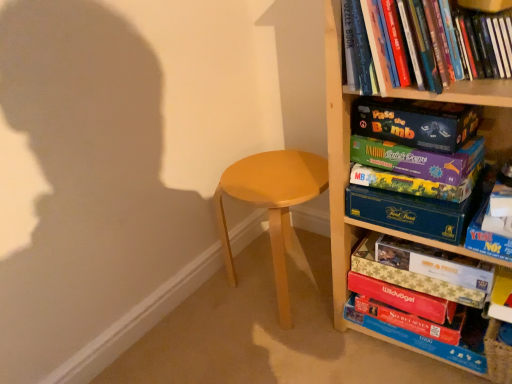
In order to click on red cardboard puzzle at lower right, the first book in the bottom-to-top sequence in this screenshot , I will do [x=406, y=275].

Describe the element at coordinates (414, 320) in the screenshot. I see `red matte board game at lower right, acting as the first paperback book starting from the bottom` at that location.

What is the approximate width of light brown wood stool at center?

16.98 inches.

In order to click on gold foil puzzle box at lower right, the fifth paperback book in the top-to-bottom sequence in this screenshot , I will do `click(435, 263)`.

Describe the element at coordinates (415, 122) in the screenshot. I see `matte black game box at upper right, which is counted as the seventh paperback book, starting from the bottom` at that location.

You are a GUI agent. You are given a task and a screenshot of the screen. Output one action in this format:
    pyautogui.click(x=<x>, y=<y>)
    Task: Click on the wooden bookcase at right
    
    Given the screenshot: What is the action you would take?
    pyautogui.click(x=347, y=182)

Locate an element on the screen. This screenshot has width=512, height=384. hardcover book at upper right, the second book in the top-to-bottom sequence is located at coordinates (485, 44).

How much space does hardcover book at upper right, which appears as the second book when ordered from the bottom, occupy horizontally?

It is 7.22 inches.

Locate an element on the screen. The width and height of the screenshot is (512, 384). red cardboard puzzle at lower right, the first book in the bottom-to-top sequence is located at coordinates (406, 275).

Is gold foil puzzle box at lower right, the fifth paperback book in the top-to-bottom sequence, far away from blue cardboard game box at center-right, placed as the 4th paperback book when sorted from top to bottom?

Actually, gold foil puzzle box at lower right, the fifth paperback book in the top-to-bottom sequence, and blue cardboard game box at center-right, placed as the 4th paperback book when sorted from top to bottom, are a little close together.

Is gold foil puzzle box at lower right, which ranks as the third paperback book in bottom-to-top order, aimed at blue cardboard game box at center-right, placed as the 4th paperback book when sorted from top to bottom?

No, gold foil puzzle box at lower right, which ranks as the third paperback book in bottom-to-top order, is not oriented towards blue cardboard game box at center-right, placed as the 4th paperback book when sorted from top to bottom.

Does point (450, 275) appear closer or farther from the camera than point (368, 192)?

Point (450, 275).

From the image's perspective, which is above, gold foil puzzle box at lower right, the fifth paperback book in the top-to-bottom sequence, or blue cardboard game box at center-right, the fourth paperback book positioned from the bottom?

blue cardboard game box at center-right, the fourth paperback book positioned from the bottom, appears higher in the image.

Would you consider red matte board game at lower right, which appears as the second paperback book when ordered from the bottom, to be distant from matte purple board game at center-right, which appears as the third paperback book when viewed from the top?

red matte board game at lower right, which appears as the second paperback book when ordered from the bottom, is actually quite close to matte purple board game at center-right, which appears as the third paperback book when viewed from the top.

Is red matte board game at lower right, the 6th paperback book from the top, positioned beyond the bounds of matte purple board game at center-right, which appears as the third paperback book when viewed from the top?

Yes.

Between red matte board game at lower right, which appears as the second paperback book when ordered from the bottom, and matte purple board game at center-right, which appears as the fifth paperback book when ordered from the bottom, which one has larger width?

red matte board game at lower right, which appears as the second paperback book when ordered from the bottom.

Between red matte board game at lower right, which appears as the second paperback book when ordered from the bottom, and matte purple board game at center-right, which appears as the fifth paperback book when ordered from the bottom, which one has less height?

Standing shorter between the two is matte purple board game at center-right, which appears as the fifth paperback book when ordered from the bottom.

Which of these two, light brown wood stool at center or gold foil puzzle box at lower right, the fifth paperback book in the top-to-bottom sequence, stands shorter?

Standing shorter between the two is gold foil puzzle box at lower right, the fifth paperback book in the top-to-bottom sequence.

Which paperback book is the 7th one when counting from the right side of the light brown wood stool at center? Please provide its 2D coordinates.

[(435, 263)]

Which of these two, light brown wood stool at center or gold foil puzzle box at lower right, which ranks as the third paperback book in bottom-to-top order, is bigger?

light brown wood stool at center is bigger.

Between light brown wood stool at center and gold foil puzzle box at lower right, which ranks as the third paperback book in bottom-to-top order, which one appears on the left side from the viewer's perspective?

light brown wood stool at center is more to the left.

Consider the image. Does red matte board game at lower right, which appears as the second paperback book when ordered from the bottom, appear on the right side of hardcover books at upper right, the third book positioned from the bottom?

Yes, red matte board game at lower right, which appears as the second paperback book when ordered from the bottom, is to the right of hardcover books at upper right, the third book positioned from the bottom.

Identify the location of the 6th paperback book located beneath the hardcover books at upper right, the third book positioned from the bottom (from a real-world perspective). (403, 298).

Does point (430, 318) come behind point (429, 88)?

Yes, it is.

Can you confirm if light brown wood stool at center is positioned to the left of red matte board game at lower right, the 6th paperback book from the top?

Yes, light brown wood stool at center is to the left of red matte board game at lower right, the 6th paperback book from the top.

Can we say light brown wood stool at center lies outside red matte board game at lower right, which appears as the second paperback book when ordered from the bottom?

Yes, light brown wood stool at center is outside of red matte board game at lower right, which appears as the second paperback book when ordered from the bottom.

From the image's perspective, would you say light brown wood stool at center is positioned over red matte board game at lower right, the 6th paperback book from the top?

Yes, from the image's perspective, light brown wood stool at center is on top of red matte board game at lower right, the 6th paperback book from the top.

Is light brown wood stool at center facing away from red matte board game at lower right, the 6th paperback book from the top?

No.

From the image's perspective, who appears lower, matte black game box at upper right, arranged as the 1th paperback book when viewed from the top, or red cardboard puzzle at lower right, the third book positioned from the top?

red cardboard puzzle at lower right, the third book positioned from the top, is shown below in the image.

Is the position of matte black game box at upper right, arranged as the 1th paperback book when viewed from the top, less distant than that of red cardboard puzzle at lower right, the third book positioned from the top?

Yes, matte black game box at upper right, arranged as the 1th paperback book when viewed from the top, is closer to the camera.

Is matte black game box at upper right, arranged as the 1th paperback book when viewed from the top, positioned beyond the bounds of red cardboard puzzle at lower right, the third book positioned from the top?

Yes, matte black game box at upper right, arranged as the 1th paperback book when viewed from the top, is located beyond the bounds of red cardboard puzzle at lower right, the third book positioned from the top.

Which is more to the right, gold foil puzzle box at lower right, which ranks as the third paperback book in bottom-to-top order, or hardcover books at upper right, the third book positioned from the bottom?

gold foil puzzle box at lower right, which ranks as the third paperback book in bottom-to-top order.

From a real-world perspective, is gold foil puzzle box at lower right, which ranks as the third paperback book in bottom-to-top order, physically below hardcover books at upper right, which appears as the first book when viewed from the top?

Correct, in the physical world, gold foil puzzle box at lower right, which ranks as the third paperback book in bottom-to-top order, is lower than hardcover books at upper right, which appears as the first book when viewed from the top.

Are gold foil puzzle box at lower right, the fifth paperback book in the top-to-bottom sequence, and hardcover books at upper right, the third book positioned from the bottom, beside each other?

They are not placed beside each other.

Is gold foil puzzle box at lower right, the fifth paperback book in the top-to-bottom sequence, facing away from hardcover books at upper right, which appears as the first book when viewed from the top?

No, hardcover books at upper right, which appears as the first book when viewed from the top, is not at the back of gold foil puzzle box at lower right, the fifth paperback book in the top-to-bottom sequence.

There is a blue cardboard game box at center-right, placed as the 4th paperback book when sorted from top to bottom. Where is `the 1st paperback book below it (from the image's perspective)`? The image size is (512, 384). the 1st paperback book below it (from the image's perspective) is located at coordinates (435, 263).

From the matte purple board game at center-right, which appears as the fifth paperback book when ordered from the bottom, count 3rd paperback books backward and point to it. Please provide its 2D coordinates.

[(403, 298)]

Estimate the real-world distances between objects in this image. Which object is further from hardcover books at upper right, which appears as the first book when viewed from the top, red cardboard puzzle at lower right, the third book positioned from the top, or matte purple board game at upper right, which appears as the second paperback book when viewed from the top?

red cardboard puzzle at lower right, the third book positioned from the top.

Which object lies further to the anchor point wooden bookcase at right, blue cardboard game box at center-right, the fourth paperback book positioned from the bottom, or red matte board game at lower right, acting as the 7th paperback book starting from the top?

red matte board game at lower right, acting as the 7th paperback book starting from the top, lies further to wooden bookcase at right than the other object.

From the image, which object appears to be nearer to blue cardboard game box at center-right, placed as the 4th paperback book when sorted from top to bottom, red matte board game at lower right, the 6th paperback book from the top, or matte black game box at upper right, which is counted as the seventh paperback book, starting from the bottom?

Based on the image, matte black game box at upper right, which is counted as the seventh paperback book, starting from the bottom, appears to be nearer to blue cardboard game box at center-right, placed as the 4th paperback book when sorted from top to bottom.

Which object lies nearer to the anchor point red cardboard puzzle at lower right, the first book in the bottom-to-top sequence, matte purple board game at center-right, which appears as the third paperback book when viewed from the top, or light brown wood stool at center?

matte purple board game at center-right, which appears as the third paperback book when viewed from the top, is closer to red cardboard puzzle at lower right, the first book in the bottom-to-top sequence.

Looking at the image, which one is located further to hardcover book at upper right, which appears as the second book when ordered from the bottom, gold foil puzzle box at lower right, the fifth paperback book in the top-to-bottom sequence, or red matte board game at lower right, acting as the first paperback book starting from the bottom?

Based on the image, red matte board game at lower right, acting as the first paperback book starting from the bottom, appears to be further to hardcover book at upper right, which appears as the second book when ordered from the bottom.

Based on their spatial positions, is blue cardboard game box at center-right, the fourth paperback book positioned from the bottom, or matte purple board game at center-right, which appears as the fifth paperback book when ordered from the bottom, further from hardcover book at upper right, which appears as the second book when ordered from the bottom?

blue cardboard game box at center-right, the fourth paperback book positioned from the bottom.

From the image, which object appears to be nearer to gold foil puzzle box at lower right, the fifth paperback book in the top-to-bottom sequence, matte black game box at upper right, which is counted as the seventh paperback book, starting from the bottom, or hardcover books at upper right, the third book positioned from the bottom?

Based on the image, matte black game box at upper right, which is counted as the seventh paperback book, starting from the bottom, appears to be nearer to gold foil puzzle box at lower right, the fifth paperback book in the top-to-bottom sequence.

Based on their spatial positions, is red cardboard puzzle at lower right, the third book positioned from the top, or hardcover book at upper right, which appears as the second book when ordered from the bottom, further from matte black game box at upper right, which is counted as the seventh paperback book, starting from the bottom?

Among the two, red cardboard puzzle at lower right, the third book positioned from the top, is located further to matte black game box at upper right, which is counted as the seventh paperback book, starting from the bottom.

You are a GUI agent. You are given a task and a screenshot of the screen. Output one action in this format:
    pyautogui.click(x=<x>, y=<y>)
    Task: Click on the book that lies between hardcover books at upper right, the third book positioned from the bottom, and wooden bookcase at right from top to bottom
    The image size is (512, 384).
    Given the screenshot: What is the action you would take?
    pyautogui.click(x=485, y=44)

Find the location of a particular element. The width and height of the screenshot is (512, 384). book that lies between hardcover books at upper right, the third book positioned from the bottom, and red matte board game at lower right, the 6th paperback book from the top, from top to bottom is located at coordinates (485, 44).

At what (x,y) coordinates should I click in order to perform the action: click on stool between matte black game box at upper right, which is counted as the seventh paperback book, starting from the bottom, and red cardboard puzzle at lower right, the third book positioned from the top, from top to bottom. Please return your answer as a coordinate pair (x, y). Looking at the image, I should click on (272, 204).

In order to click on bookcase between hardcover books at upper right, the third book positioned from the bottom, and gold foil puzzle box at lower right, the fifth paperback book in the top-to-bottom sequence, in the up-down direction in this screenshot , I will do `click(347, 182)`.